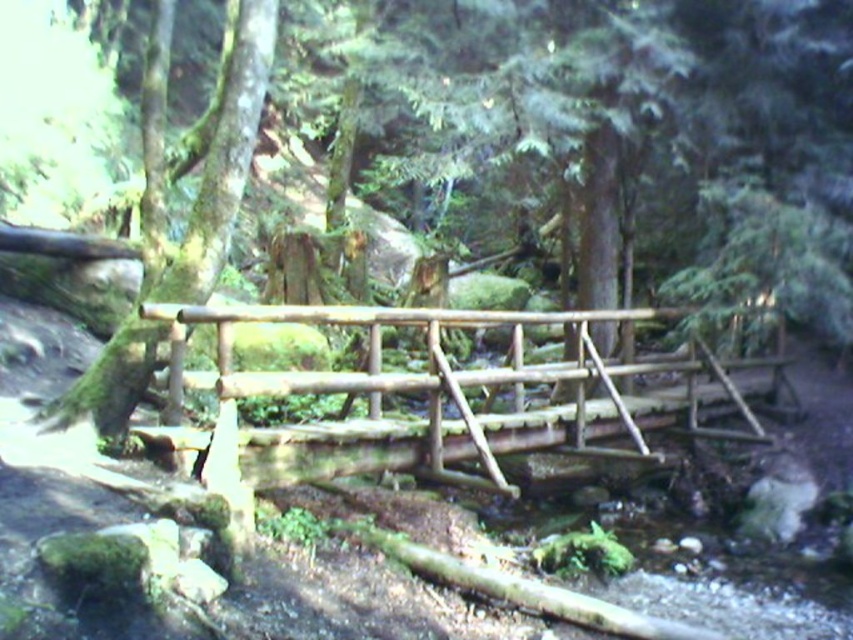
Does natural wood bridge at center have a lesser width compared to green mossy tree at left?

No, natural wood bridge at center is not thinner than green mossy tree at left.

Is point (451, 477) closer to camera compared to point (61, 420)?

No.

At what (x,y) coordinates should I click in order to perform the action: click on natural wood bridge at center. Please return your answer as a coordinate pair (x, y). Looking at the image, I should click on (465, 384).